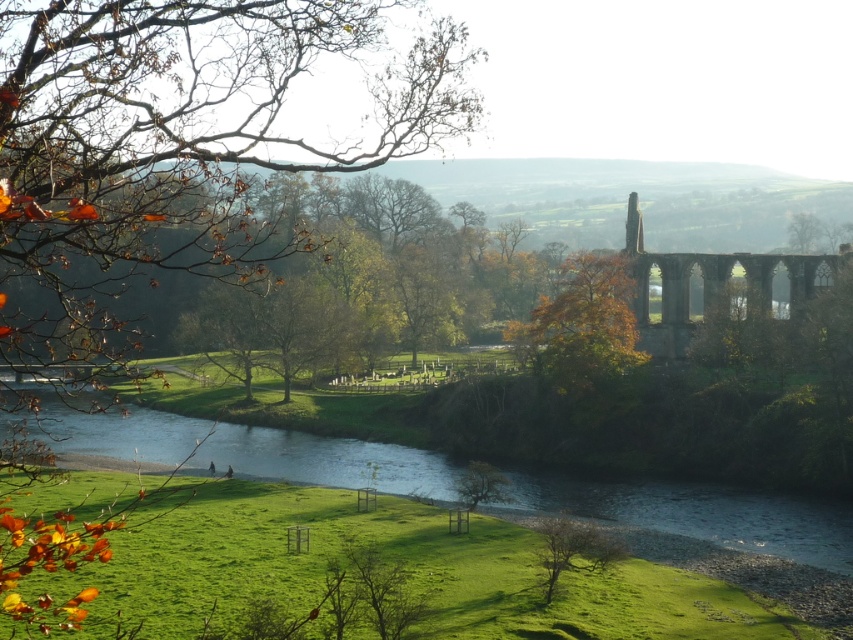
Question: Which point is closer to the camera?

Choices:
 (A) bare branches at lower center
 (B) stone arches at right
 (C) brown leafy branch at upper left
 (D) green grassy river at lower center

Answer: (C)

Question: Can you confirm if green grassy river at lower center is thinner than bare branches at lower center?

Choices:
 (A) no
 (B) yes

Answer: (A)

Question: Can you confirm if brown leafy branch at upper left is positioned below green grassy river at lower center?

Choices:
 (A) yes
 (B) no

Answer: (B)

Question: Which object is farther from the camera taking this photo?

Choices:
 (A) green grass at lower center
 (B) brown leafy branch at upper left

Answer: (A)

Question: Which point is farther from the camera taking this photo?

Choices:
 (A) (592, 522)
 (B) (749, 296)
 (C) (64, 621)
 (D) (469, 534)

Answer: (B)

Question: Considering the relative positions of brown leafy branch at upper left and stone arches at right in the image provided, where is brown leafy branch at upper left located with respect to stone arches at right?

Choices:
 (A) below
 (B) above

Answer: (B)